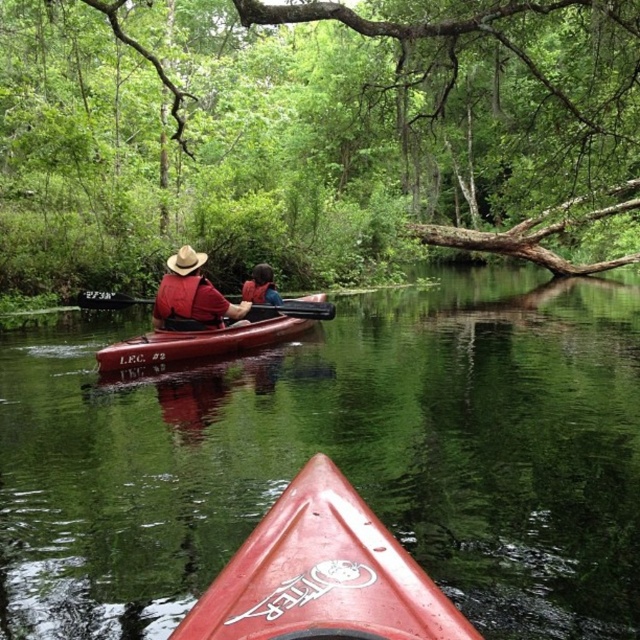
You are a photographer trying to capture a closeup of the matte red shirt at center. Based on the scene description, where should you position your camera to ensure the shirt is in the center of your shot?

The matte red shirt at center is located at the coordinates point (192, 296), so positioning the camera to aim directly at that point will center the shirt in the shot.

Looking at this image, you are standing at the camera position and want to reach point (208, 342). Is the distance more than 30 feet?

Yes, the distance between the camera and point (208, 342) is 34.08 feet, which is more than 30 feet.